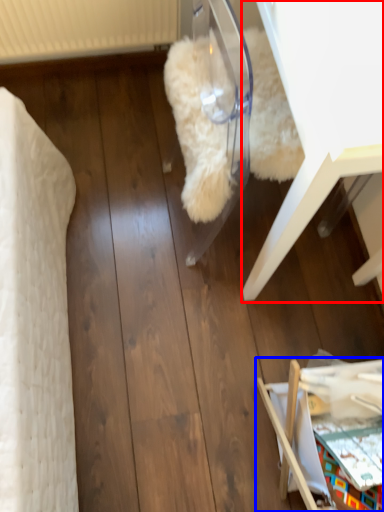
Question: Which of the following is the farthest to the observer, furniture (highlighted by a red box) or furniture (highlighted by a blue box)?

Choices:
 (A) furniture
 (B) furniture

Answer: (B)